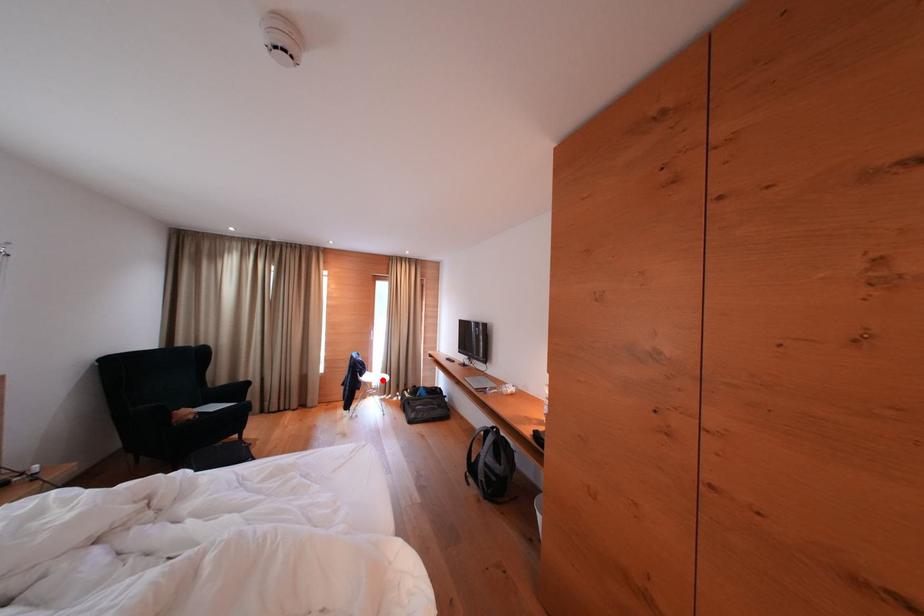
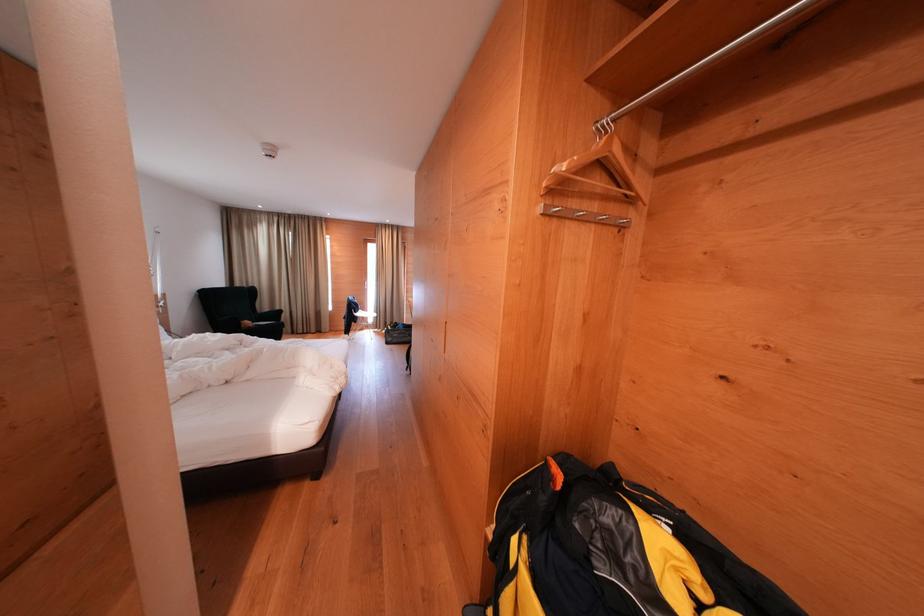
Question: A red point is marked in image1. In image2, is the corresponding 3D point closer to the camera or farther? Reply with the corresponding letter.

Choices:
 (A) The corresponding 3D point is closer.
 (B) The corresponding 3D point is farther.

Answer: (A)